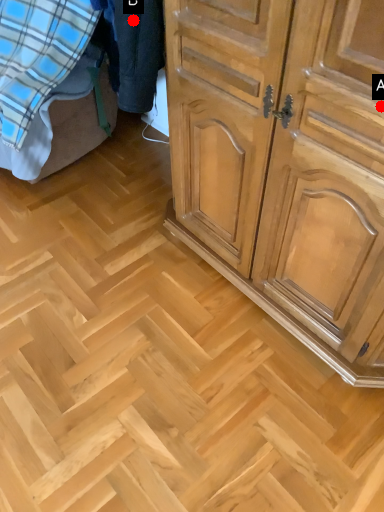
Question: Two points are circled on the image, labeled by A and B beside each circle. Which point is closer to the camera?

Choices:
 (A) A is closer
 (B) B is closer

Answer: (A)